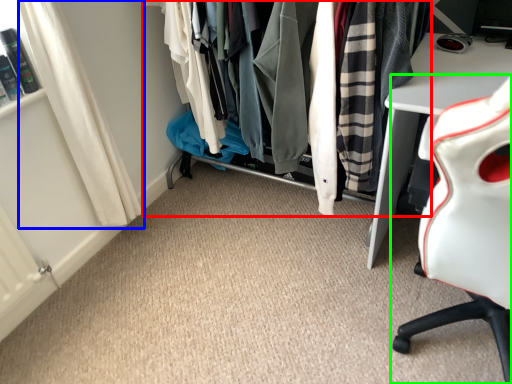
Question: Which object is the closest to the closet (highlighted by a red box)? Choose among these: curtain (highlighted by a blue box) or chair (highlighted by a green box).

Choices:
 (A) curtain
 (B) chair

Answer: (B)